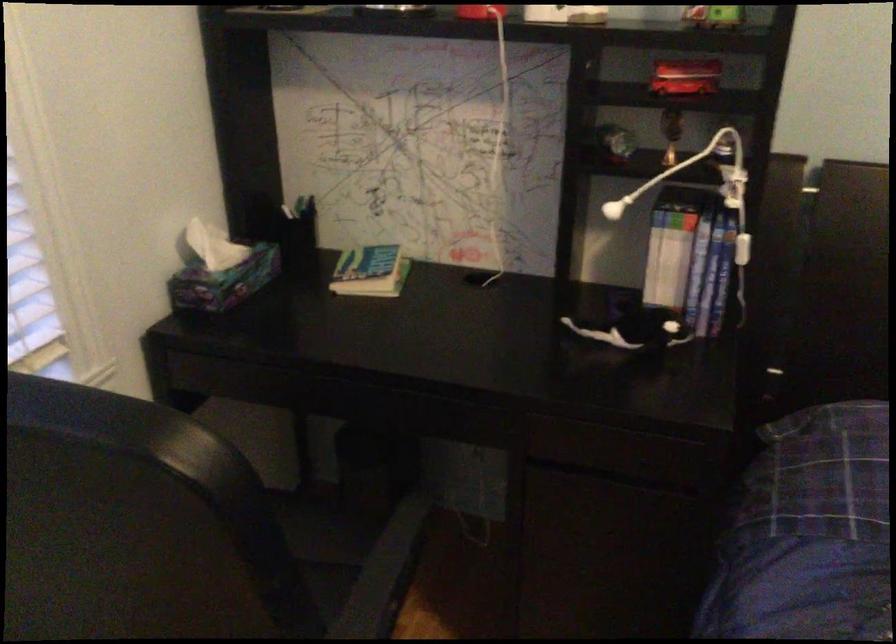
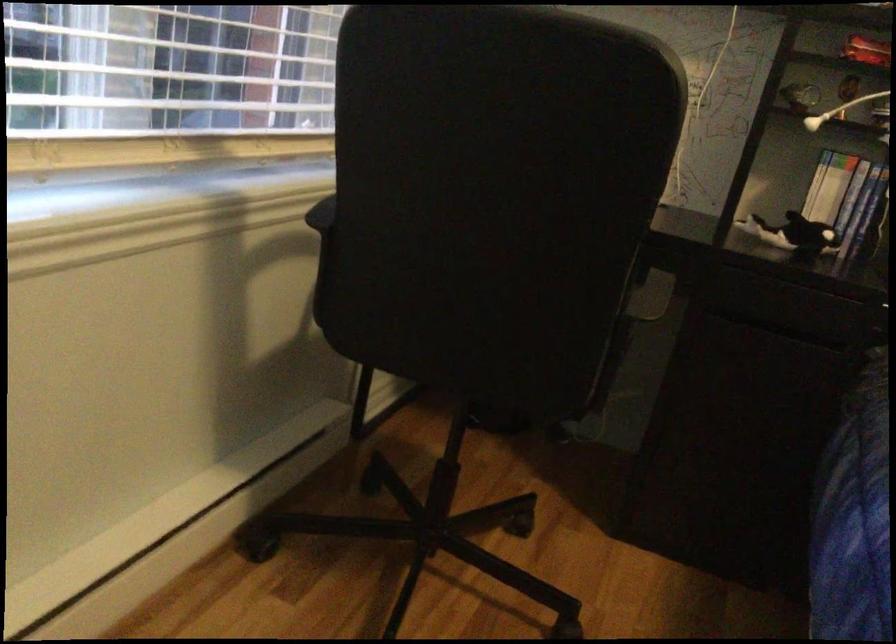
Question: I am providing you with two images of the same scene from different viewpoints. Please identify which objects are invisible in image2.

Choices:
 (A) dark pen
 (B) white earbud
 (C) green cloth
 (D) blue book spine

Answer: (A)